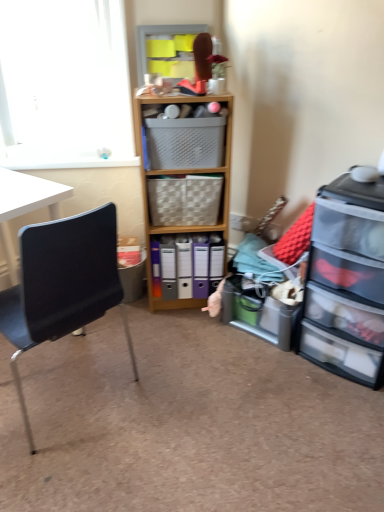
Question: In the image, is translucent plastic storage at lower right, which is the second shelf from top to bottom, on the left side or the right side of woven beige picnic basket at center, arranged as the first picnic basket when ordered from the bottom?

Choices:
 (A) right
 (B) left

Answer: (A)

Question: From a real-world perspective, is translucent plastic storage at lower right, the 2th shelf positioned from the left, physically located above or below woven beige picnic basket at center, which ranks as the 2th picnic basket in top-to-bottom order?

Choices:
 (A) above
 (B) below

Answer: (B)

Question: Which is farther from the plastic basket at center, the second picnic basket positioned from the bottom?

Choices:
 (A) wooden cabinet at center
 (B) white matte window screen at upper left
 (C) black matte chair at left
 (D) woven beige picnic basket at center, arranged as the first picnic basket when ordered from the bottom
 (E) clear plastic drawers at right

Answer: (E)

Question: Which of these objects is positioned farthest from the white matte window screen at upper left?

Choices:
 (A) black matte chair at left
 (B) matte plastic storage box at lower left
 (C) wooden cabinet at center
 (D) clear plastic drawers at right
 (E) translucent plastic storage at lower right, which is the second shelf from top to bottom

Answer: (D)